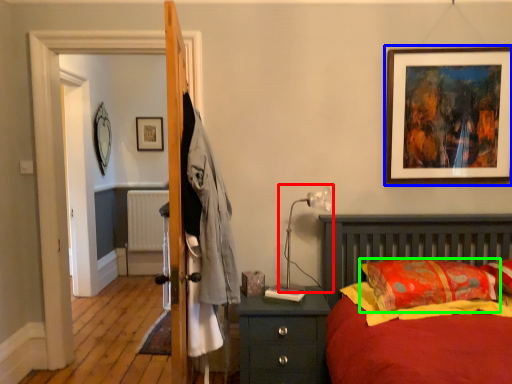
Question: Estimate the real-world distances between objects in this image. Which object is farther from table lamp (highlighted by a red box), picture frame (highlighted by a blue box) or pillow (highlighted by a green box)?

Choices:
 (A) picture frame
 (B) pillow

Answer: (A)